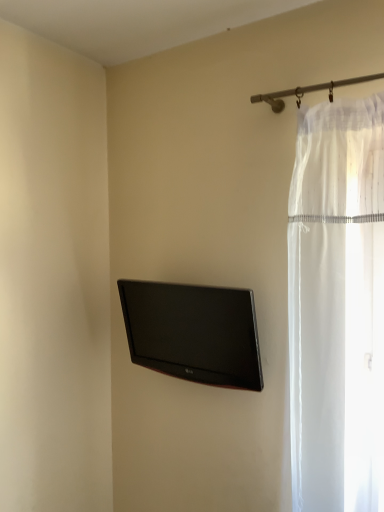
Locate an element on the screen. black glossy tv at center is located at coordinates (193, 332).

The height and width of the screenshot is (512, 384). What do you see at coordinates (193, 332) in the screenshot?
I see `black glossy tv at center` at bounding box center [193, 332].

Where is `black glossy tv at center`? black glossy tv at center is located at coordinates (193, 332).